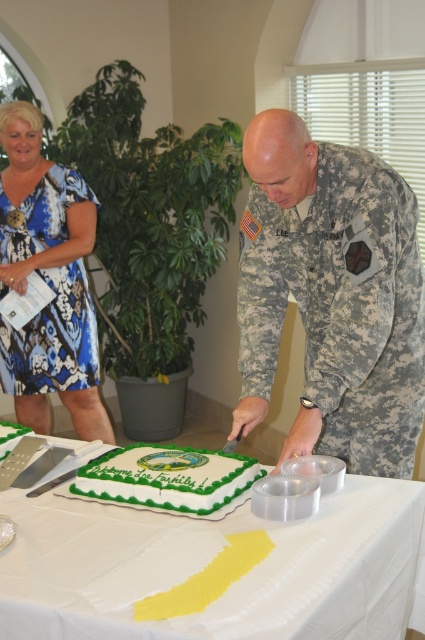
Question: Estimate the real-world distances between objects in this image. Which object is closer to the white paper tablecloth at center?

Choices:
 (A) blue printed dress at upper left
 (B) camouflage fabric uniform at center
 (C) camouflage uniform at center

Answer: (C)

Question: Is white paper tablecloth at center positioned before blue printed dress at upper left?

Choices:
 (A) yes
 (B) no

Answer: (A)

Question: Among these objects, which one is nearest to the camera?

Choices:
 (A) camouflage uniform at center
 (B) green frosted cake at center
 (C) blue printed dress at upper left

Answer: (B)

Question: Does white paper tablecloth at center have a smaller size compared to blue printed dress at upper left?

Choices:
 (A) yes
 (B) no

Answer: (A)

Question: Is camouflage uniform at center in front of camouflage fabric uniform at center?

Choices:
 (A) yes
 (B) no

Answer: (A)

Question: Which object is farther from the camera taking this photo?

Choices:
 (A) green frosted cake at center
 (B) white paper tablecloth at center
 (C) camouflage uniform at center
 (D) camouflage fabric uniform at center

Answer: (D)